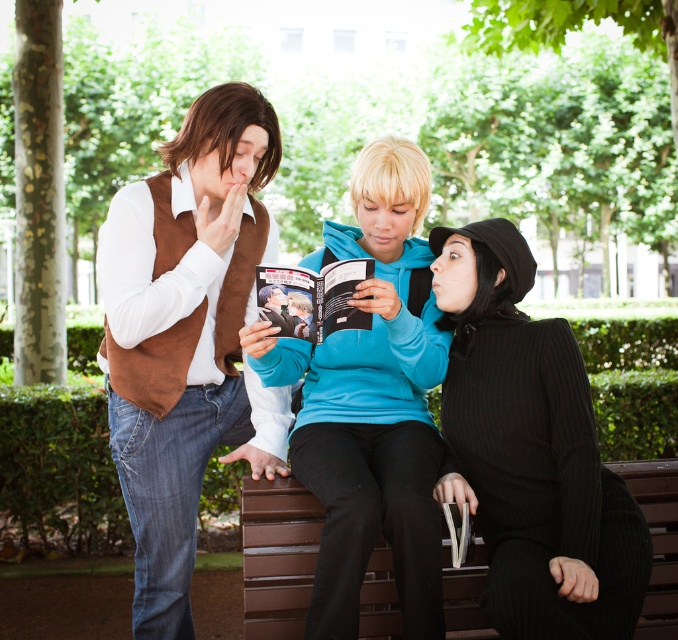
Who is shorter, brown wooden bench at lower center or matte brown vest at center?

With less height is matte brown vest at center.

Find the location of a particular element. The height and width of the screenshot is (640, 678). brown wooden bench at lower center is located at coordinates (277, 556).

Does suede brown vest at left lie behind brown wooden bench at lower center?

That is True.

Is the position of suede brown vest at left less distant than that of brown wooden bench at lower center?

No, it is not.

The image size is (678, 640). What are the coordinates of `suede brown vest at left` in the screenshot? It's located at (186, 337).

The image size is (678, 640). Identify the location of suede brown vest at left. pyautogui.click(x=186, y=337).

Is blue fleece jacket at center to the left of matte brown vest at center from the viewer's perspective?

In fact, blue fleece jacket at center is to the right of matte brown vest at center.

Which is behind, point (395, 220) or point (283, 314)?

Point (395, 220)

Between point (308, 413) and point (290, 330), which one is positioned behind?

Positioned behind is point (308, 413).

This screenshot has width=678, height=640. In order to click on blue fleece jacket at center in this screenshot , I will do `click(372, 401)`.